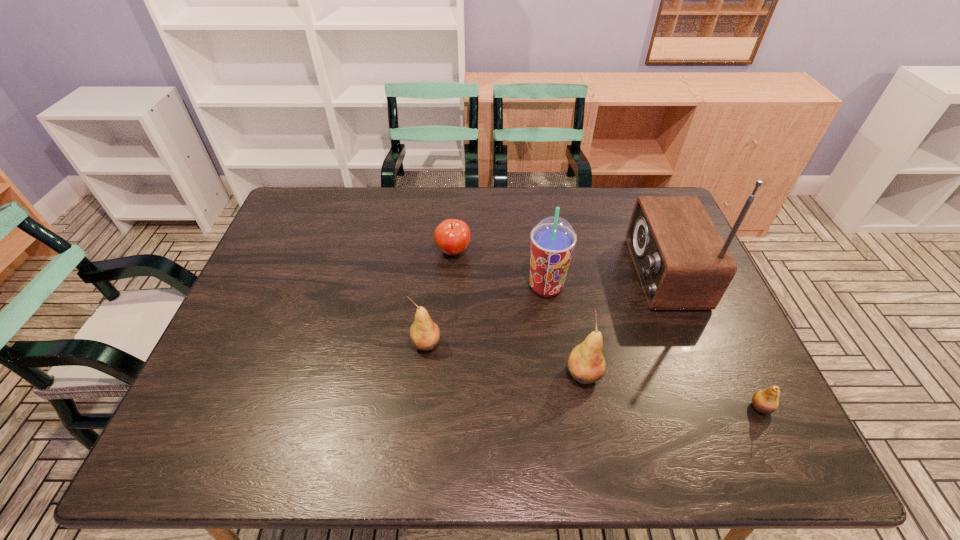
Identify the location of free space that is in between the smoothie and the farthest pear. (486, 315).

At what (x,y) coordinates should I click in order to perform the action: click on free space between the fifth shortest object and the apple. Please return your answer as a coordinate pair (x, y). Image resolution: width=960 pixels, height=540 pixels. Looking at the image, I should click on (499, 269).

Identify which object is the third nearest to the tallest object. Please provide its 2D coordinates. Your answer should be formatted as a tuple, i.e. [(x, y)], where the tuple contains the x and y coordinates of a point satisfying the conditions above.

[(766, 401)]

Select which object is the fourth closest to the apple. Please provide its 2D coordinates. Your answer should be formatted as a tuple, i.e. [(x, y)], where the tuple contains the x and y coordinates of a point satisfying the conditions above.

[(682, 262)]

At what (x,y) coordinates should I click in order to perform the action: click on the closest pear to the radio receiver. Please return your answer as a coordinate pair (x, y). Image resolution: width=960 pixels, height=540 pixels. Looking at the image, I should click on (586, 364).

Identify which pear is the nearest to the apple. Please provide its 2D coordinates. Your answer should be formatted as a tuple, i.e. [(x, y)], where the tuple contains the x and y coordinates of a point satisfying the conditions above.

[(424, 334)]

Identify the location of free location that satisfies the following two spatial constraints: 1. on the front side of the shortest pear; 2. on the left side of the smoothie. (563, 408).

At what (x,y) coordinates should I click in order to perform the action: click on vacant space that satisfies the following two spatial constraints: 1. on the front-facing side of the tallest object; 2. on the left side of the rightmost pear. Please return your answer as a coordinate pair (x, y). This screenshot has width=960, height=540. Looking at the image, I should click on (717, 408).

Where is `free space that satisfies the following two spatial constraints: 1. on the front side of the apple; 2. on the right side of the fifth shortest object`? The height and width of the screenshot is (540, 960). free space that satisfies the following two spatial constraints: 1. on the front side of the apple; 2. on the right side of the fifth shortest object is located at coordinates (451, 287).

This screenshot has width=960, height=540. I want to click on vacant space that satisfies the following two spatial constraints: 1. on the front side of the shortest pear; 2. on the left side of the second nearest object, so click(x=590, y=408).